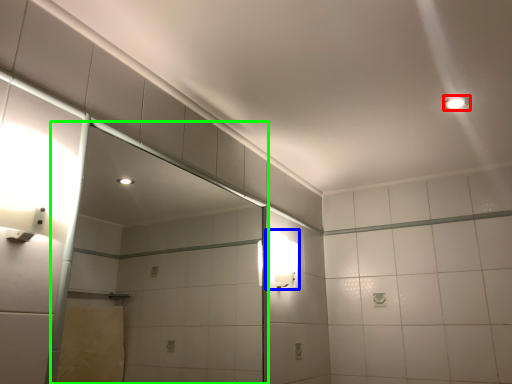
Question: Considering the real-world distances, which object is closest to light fixture (highlighted by a red box)? light fixture (highlighted by a blue box) or glass door (highlighted by a green box).

Choices:
 (A) light fixture
 (B) glass door

Answer: (A)